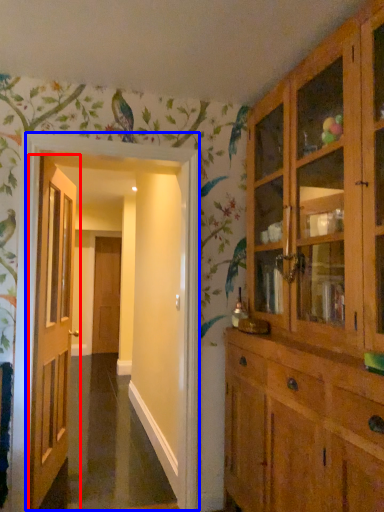
Question: Which object is closer to the camera taking this photo, door (highlighted by a red box) or corridor (highlighted by a blue box)?

Choices:
 (A) door
 (B) corridor

Answer: (B)